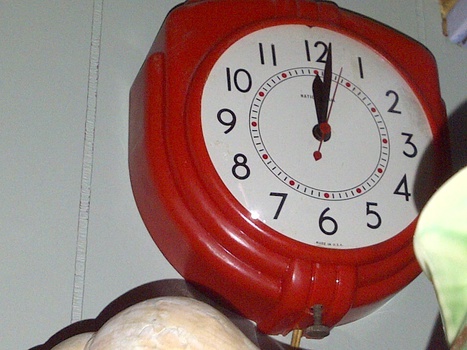
At what (x,y) coordinates should I click in order to perform the action: click on wall. Please return your answer as a coordinate pair (x, y). Looking at the image, I should click on (140, 227).